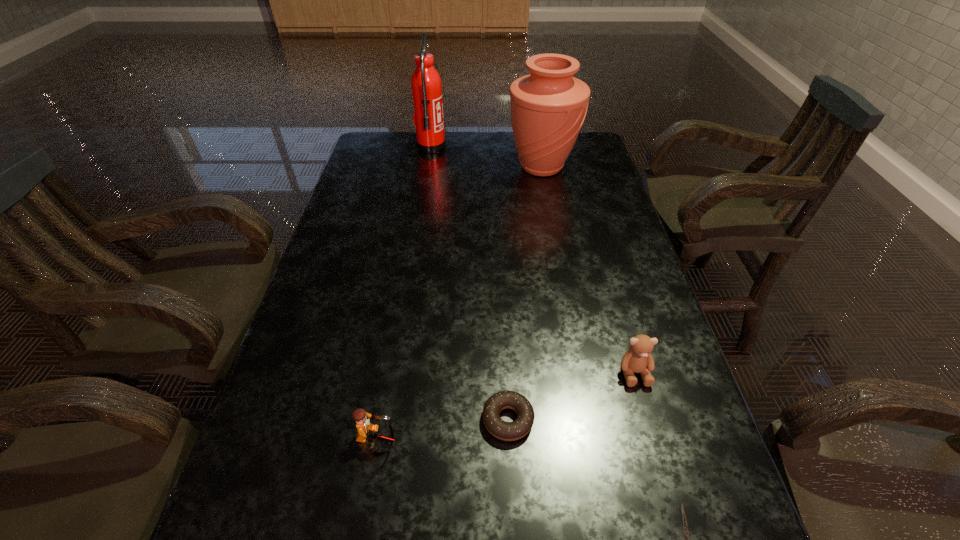
Find the location of a particular element. free space that is in between the vase and the fire extinguisher is located at coordinates (487, 157).

Image resolution: width=960 pixels, height=540 pixels. Identify the location of free spot between the fourth nearest object and the fire extinguisher. [x=533, y=260].

Find the location of a particular element. This screenshot has height=540, width=960. vacant space that is in between the fire extinguisher and the doughnut is located at coordinates (469, 284).

Where is `object identified as the fourth closest to the third farthest object`? The height and width of the screenshot is (540, 960). object identified as the fourth closest to the third farthest object is located at coordinates (548, 107).

You are a GUI agent. You are given a task and a screenshot of the screen. Output one action in this format:
    pyautogui.click(x=<x>, y=<y>)
    Task: Click on the second closest object relative to the Lego
    Image resolution: width=960 pixels, height=540 pixels.
    Given the screenshot: What is the action you would take?
    pyautogui.click(x=638, y=359)

The height and width of the screenshot is (540, 960). I want to click on vacant region that satisfies the following two spatial constraints: 1. on the label side of the vase; 2. on the left side of the fire extinguisher, so click(428, 167).

The height and width of the screenshot is (540, 960). What are the coordinates of `vacant space that satisfies the following two spatial constraints: 1. on the label side of the fire extinguisher; 2. on the left side of the doughnut` in the screenshot? It's located at (388, 420).

The image size is (960, 540). Find the location of `vacant area that satisfies the following two spatial constraints: 1. on the face of the teddy bear; 2. holding a crossbow in the hands of the Lego`. vacant area that satisfies the following two spatial constraints: 1. on the face of the teddy bear; 2. holding a crossbow in the hands of the Lego is located at coordinates (654, 440).

What are the coordinates of `free region that satisfies the following two spatial constraints: 1. on the front side of the doughnut; 2. holding a crossbow in the hands of the Lego` in the screenshot? It's located at (509, 440).

This screenshot has width=960, height=540. What are the coordinates of `vacant point that satisfies the following two spatial constraints: 1. on the back side of the vase; 2. on the right side of the doughnut` in the screenshot? It's located at click(x=496, y=167).